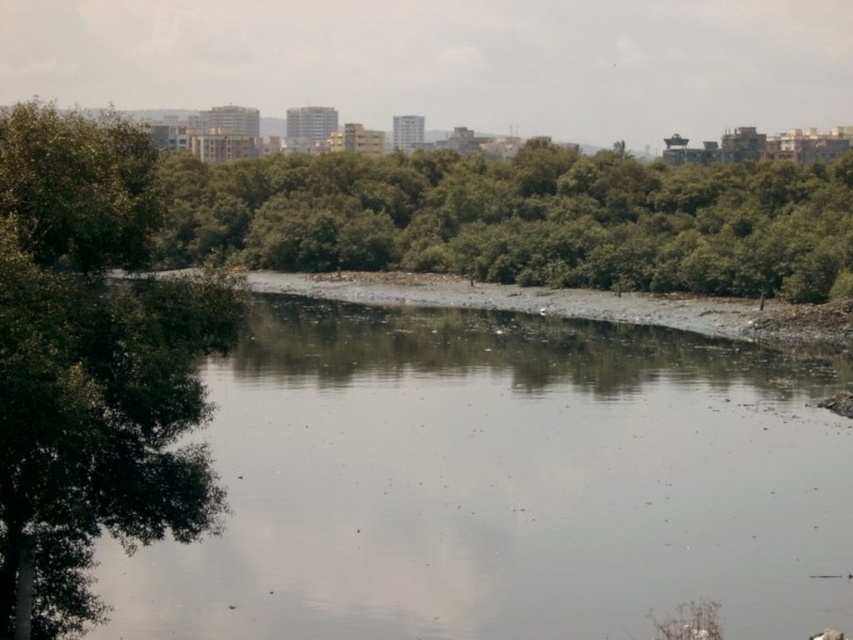
Looking at this image, you are standing at the riverside and want to move from point A to point B. Point A is located at coordinates point [576,412] and point B is at point [35,419]. Which point is closer to you when you start at point A?

Point A is further to the viewer than point B, so when starting at point A, point B is closer to you.

You are a landscape architect designing a new park. You have to decide whether to place a large statue in the gray gravel river at center or near the green leafy tree at left. Based on their sizes, which location would allow the statue to be more prominently visible without overcrowding the area?

The gray gravel river at center is bigger than the green leafy tree at left, so placing the large statue in the gray gravel river at center would allow it to be more prominently visible without overcrowding the area.

You are standing at the edge of the green leafy tree at left and want to walk to the gray gravel river at center. In which direction should you move?

You should move to the right to reach the gray gravel river at center from the green leafy tree at left because the gray gravel river at center is located to the right of the green leafy tree at left.